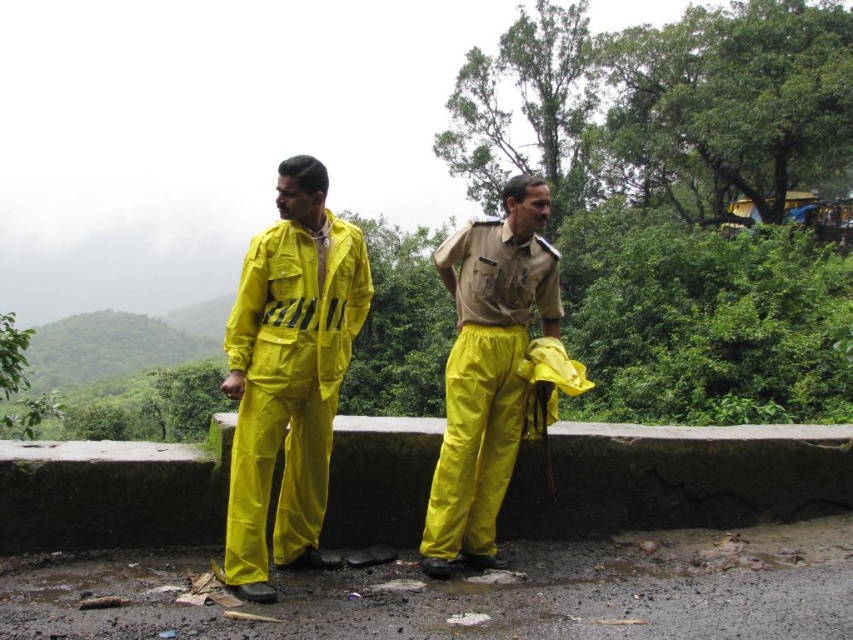
You are a pedestrian trying to cross a wet paved path and see two items in the center. The items are the yellow matte raincoat at center and the yellow matte pants at center. Which item is positioned closer to you?

The yellow matte raincoat at center is closer to the viewer than the yellow matte pants at center.

You are a safety inspector evaluating the visibility of workers in a rainy environment. You observe two workers wearing the rubberized yellow jumpsuit at center and the yellow matte raincoat at center. Which worker is wearing the taller garment?

The rubberized yellow jumpsuit at center has a greater height compared to the yellow matte raincoat at center, so the worker wearing the rubberized yellow jumpsuit at center has the taller garment.

You are a safety inspector assessing the visibility of workers in a rainy environment. You observe two workers wearing the rubberized yellow jumpsuit at center and the yellow matte pants at center. Which worker is shorter in height?

The rubberized yellow jumpsuit at center has a lesser height compared to yellow matte pants at center, so the worker wearing the rubberized yellow jumpsuit at center is shorter in height.